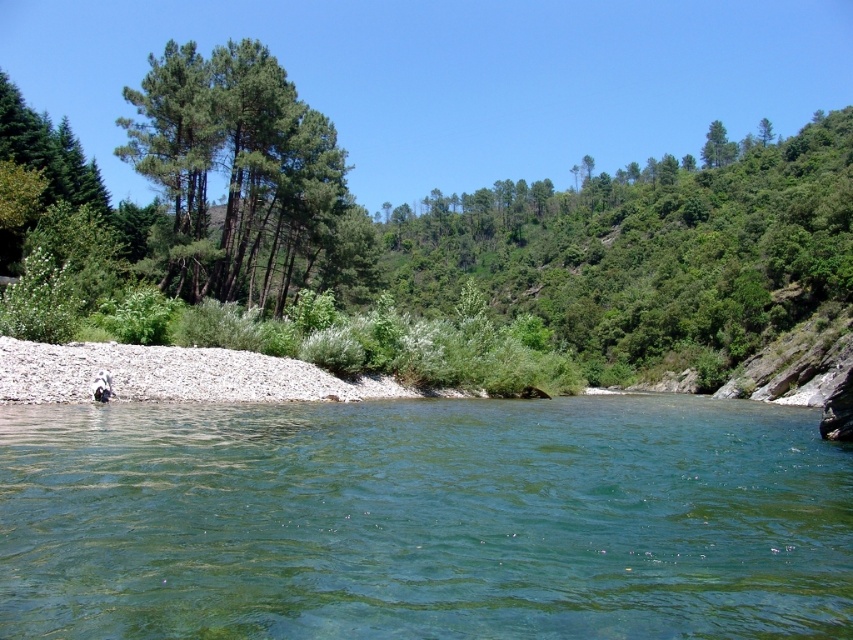
Question: Is clear water at center smaller than green matte trees at left?

Choices:
 (A) yes
 (B) no

Answer: (A)

Question: Does clear water at center have a larger size compared to green matte trees at left?

Choices:
 (A) no
 (B) yes

Answer: (A)

Question: Which object is farther from the camera taking this photo?

Choices:
 (A) clear water at center
 (B) green matte trees at left

Answer: (B)

Question: Can you confirm if clear water at center is wider than green matte trees at left?

Choices:
 (A) no
 (B) yes

Answer: (B)

Question: Which point appears closest to the camera in this image?

Choices:
 (A) (370, 257)
 (B) (503, 541)

Answer: (B)

Question: Which object is closer to the camera taking this photo?

Choices:
 (A) clear water at center
 (B) green matte trees at left

Answer: (A)